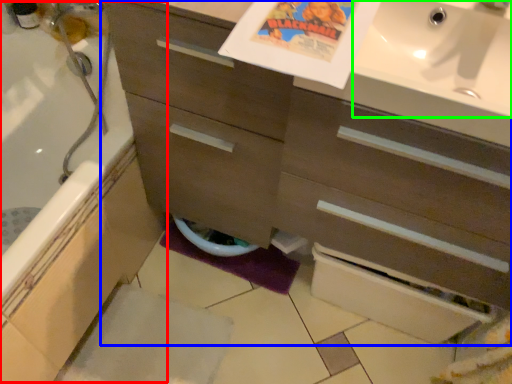
Question: Which object is the farthest from bath (highlighted by a red box)? Choose among these: bathroom cabinet (highlighted by a blue box) or sink (highlighted by a green box).

Choices:
 (A) bathroom cabinet
 (B) sink

Answer: (B)